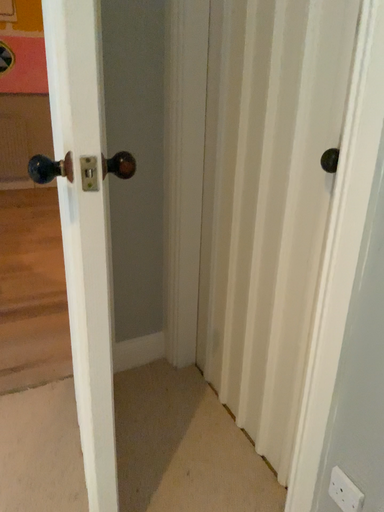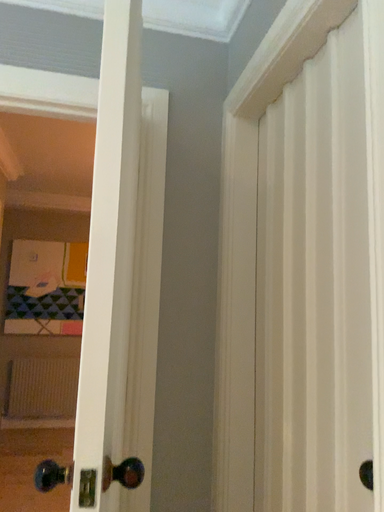
Question: How did the camera likely rotate when shooting the video?

Choices:
 (A) rotated downward
 (B) rotated upward

Answer: (B)